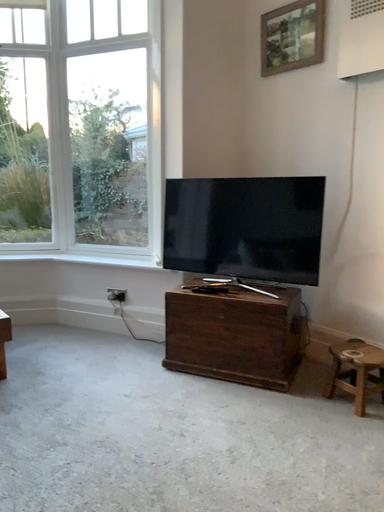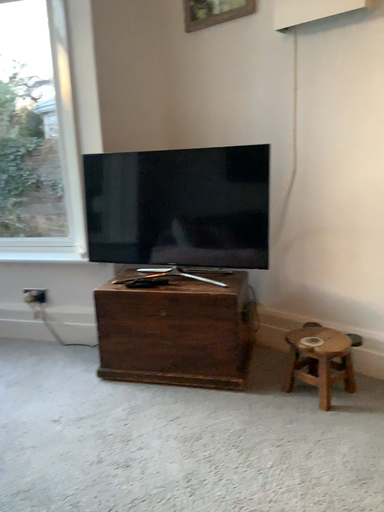
Question: How did the camera likely rotate when shooting the video?

Choices:
 (A) rotated left
 (B) rotated right

Answer: (B)